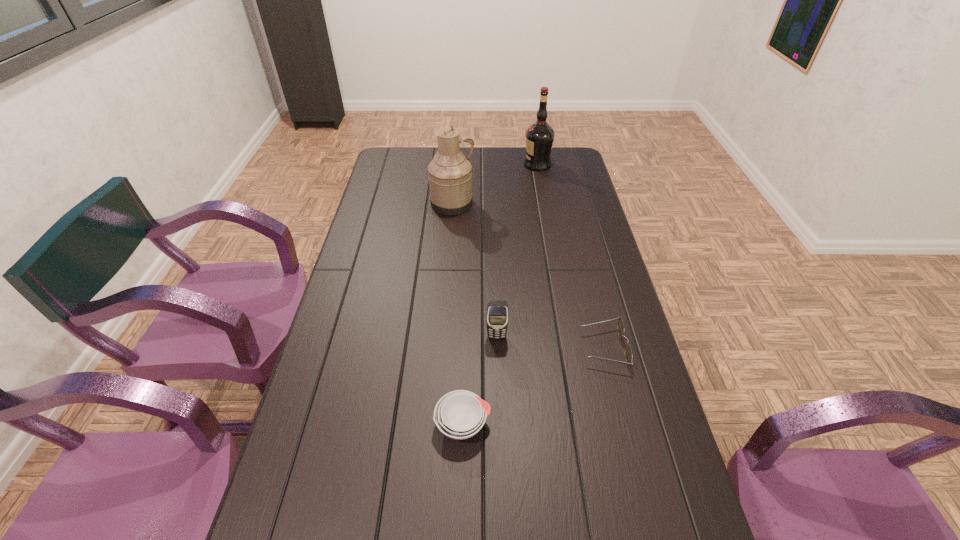
This screenshot has width=960, height=540. I want to click on liquor, so click(x=540, y=135).

I want to click on the second farthest object, so click(x=450, y=177).

Image resolution: width=960 pixels, height=540 pixels. I want to click on cellular telephone, so click(497, 315).

You are a GUI agent. You are given a task and a screenshot of the screen. Output one action in this format:
    pyautogui.click(x=<x>, y=<y>)
    Task: Click on the spectacles
    
    Given the screenshot: What is the action you would take?
    pyautogui.click(x=620, y=327)

Where is `the nearest object`? The height and width of the screenshot is (540, 960). the nearest object is located at coordinates (460, 414).

You are a GUI agent. You are given a task and a screenshot of the screen. Output one action in this format:
    pyautogui.click(x=<x>, y=<y>)
    Task: Click on the vacant space located 0.290m on the surface of the liquor
    The width and height of the screenshot is (960, 540).
    Given the screenshot: What is the action you would take?
    pyautogui.click(x=457, y=164)

Where is `vacant area located 0.340m on the surface of the liquor`? Image resolution: width=960 pixels, height=540 pixels. vacant area located 0.340m on the surface of the liquor is located at coordinates (445, 164).

Locate an element on the screen. free space located on the surface of the liquor is located at coordinates (510, 164).

The height and width of the screenshot is (540, 960). Find the location of `vacant region located on the right of the fourth nearest object`. vacant region located on the right of the fourth nearest object is located at coordinates (541, 204).

At what (x,y) coordinates should I click in order to perform the action: click on free space located 0.250m on the front face of the third tallest object. Please return your answer as a coordinate pair (x, y). This screenshot has width=960, height=540. Looking at the image, I should click on (499, 424).